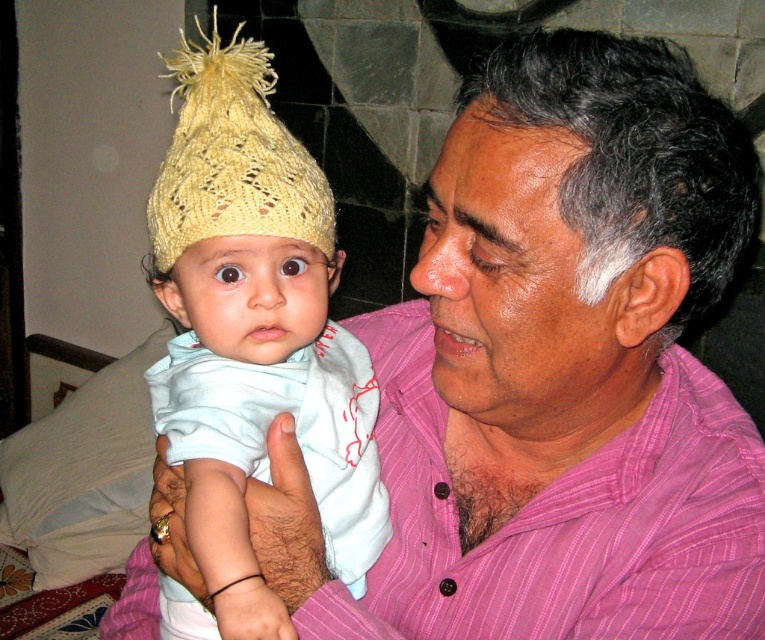
Question: Which point is farther from the camera taking this photo?

Choices:
 (A) (228, 225)
 (B) (376, 554)

Answer: (B)

Question: Does knitted yellow hat at left have a lesser width compared to yellow knitted hat at upper left?

Choices:
 (A) no
 (B) yes

Answer: (A)

Question: Which point is closer to the camera?

Choices:
 (A) (291, 392)
 (B) (262, 205)

Answer: (B)

Question: Is knitted yellow hat at left above yellow knitted hat at upper left?

Choices:
 (A) no
 (B) yes

Answer: (A)

Question: Is knitted yellow hat at left wider than yellow knitted hat at upper left?

Choices:
 (A) yes
 (B) no

Answer: (A)